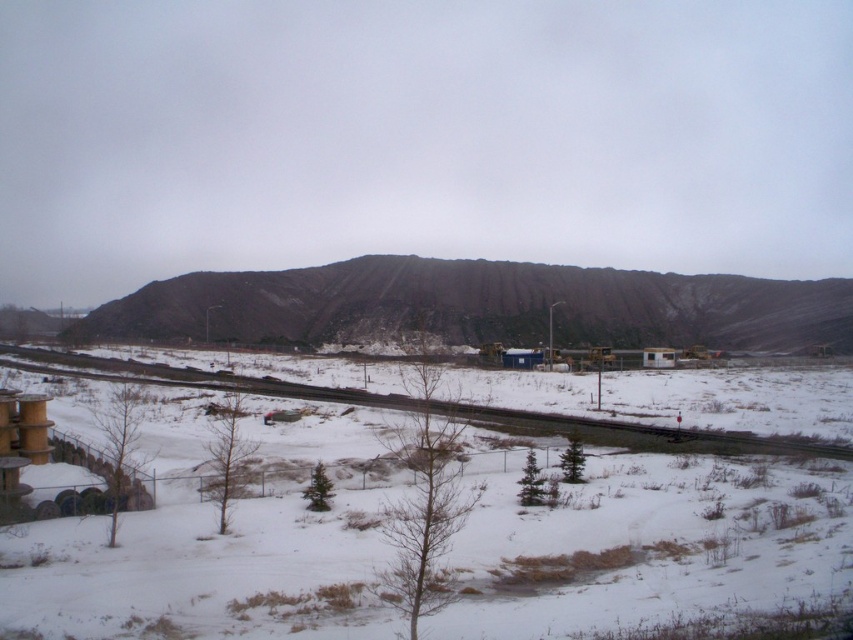
Does white powdery snow at center have a larger size compared to brown/dirt-like mountain at center?

No, white powdery snow at center is not bigger than brown/dirt-like mountain at center.

At what (x,y) coordinates should I click in order to perform the action: click on white powdery snow at center. Please return your answer as a coordinate pair (x, y). Image resolution: width=853 pixels, height=640 pixels. Looking at the image, I should click on (416, 516).

The height and width of the screenshot is (640, 853). I want to click on white powdery snow at center, so click(x=416, y=516).

Is white powdery snow at center wider than snowy gravel train track at lower center?

In fact, white powdery snow at center might be narrower than snowy gravel train track at lower center.

Who is lower down, white powdery snow at center or snowy gravel train track at lower center?

Positioned lower is white powdery snow at center.

The height and width of the screenshot is (640, 853). What do you see at coordinates (416, 516) in the screenshot?
I see `white powdery snow at center` at bounding box center [416, 516].

Identify the location of white powdery snow at center. (416, 516).

Measure the distance between brown/dirt-like mountain at center and camera.

brown/dirt-like mountain at center is 137.85 meters away from camera.

Is point (810, 342) farther from camera compared to point (444, 408)?

Yes, point (810, 342) is farther from viewer.

You are a GUI agent. You are given a task and a screenshot of the screen. Output one action in this format:
    pyautogui.click(x=<x>, y=<y>)
    Task: Click on the brown/dirt-like mountain at center
    The width and height of the screenshot is (853, 640).
    Given the screenshot: What is the action you would take?
    pyautogui.click(x=479, y=307)